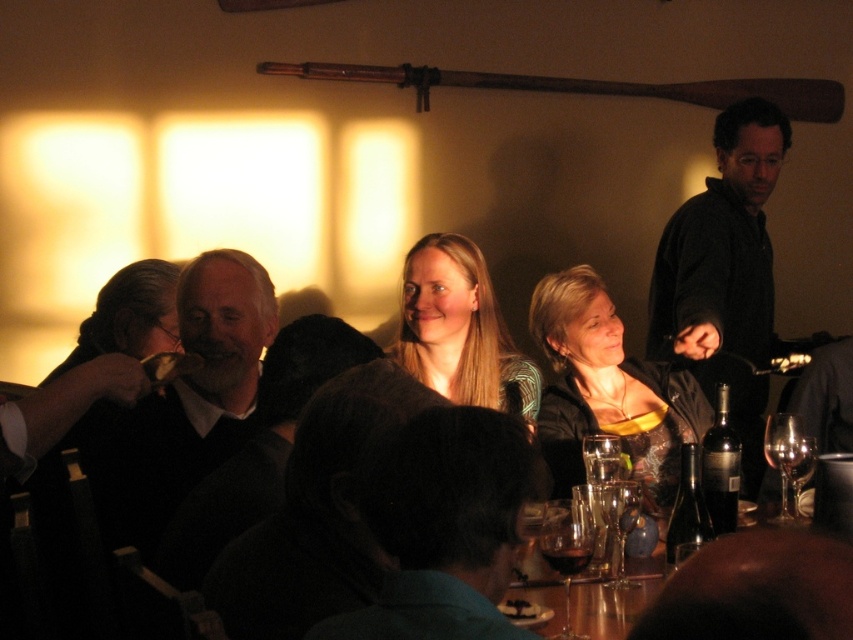
Question: Among these points, which one is nearest to the camera?

Choices:
 (A) (570, 570)
 (B) (781, 481)

Answer: (A)

Question: Which object is farther from the camera taking this photo?

Choices:
 (A) wooden table at lower center
 (B) dark glass bottle at center right

Answer: (B)

Question: Among these objects, which one is farthest from the camera?

Choices:
 (A) dark brown leather jacket at upper right
 (B) transparent glass wine glass at lower right

Answer: (A)

Question: Is clear glass wine glass at lower right smaller than translucent glass wine at table center?

Choices:
 (A) no
 (B) yes

Answer: (A)

Question: Does matte black jacket at center have a larger size compared to dark glass bottle at center right?

Choices:
 (A) no
 (B) yes

Answer: (B)

Question: Can you confirm if dark brown leather jacket at upper right is positioned to the right of clear glass wine glass at lower center?

Choices:
 (A) yes
 (B) no

Answer: (A)